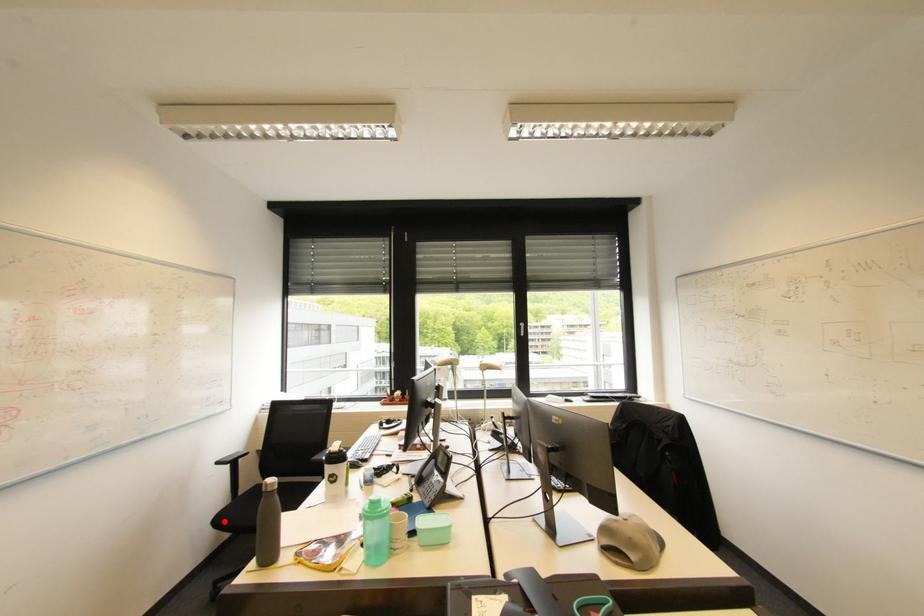
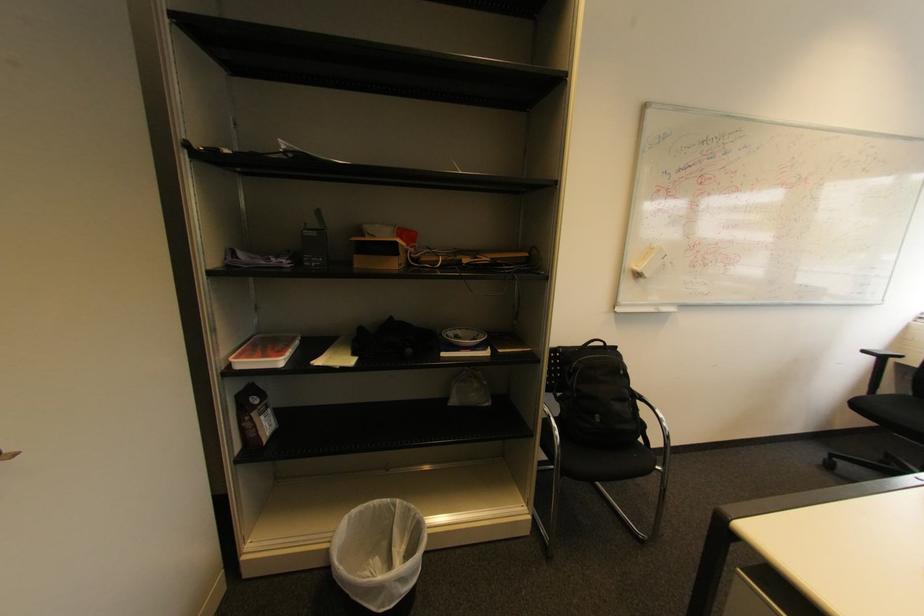
Where in the second image is the point corresponding to the highlighted location from the first image?

(861, 406)